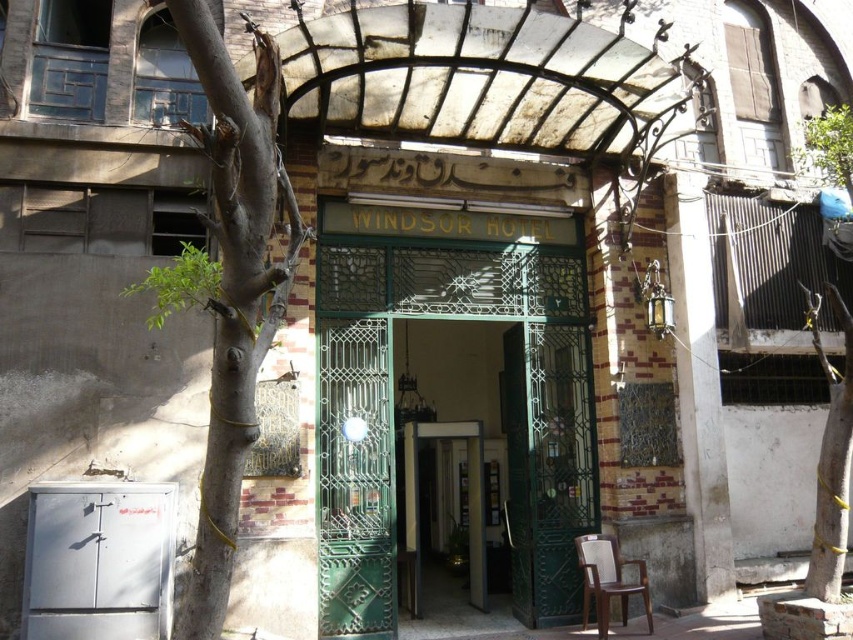
Who is shorter, gray bark tree at left or green textured bark at right?

Standing shorter between the two is green textured bark at right.

Where is `gray bark tree at left`? This screenshot has height=640, width=853. gray bark tree at left is located at coordinates (231, 288).

Identify the location of gray bark tree at left. Image resolution: width=853 pixels, height=640 pixels. (231, 288).

Consider the image. Does green metal gate at center have a lesser height compared to brown wooden chair at lower right?

No, green metal gate at center is not shorter than brown wooden chair at lower right.

Who is positioned more to the right, green metal gate at center or brown wooden chair at lower right?

Positioned to the right is brown wooden chair at lower right.

The image size is (853, 640). In order to click on green metal gate at center in this screenshot , I will do `click(492, 342)`.

In order to click on green metal gate at center in this screenshot , I will do `click(492, 342)`.

How far apart are gray bark tree at left and brown wooden chair at lower right?

The distance of gray bark tree at left from brown wooden chair at lower right is 4.51 meters.

Can you confirm if gray bark tree at left is thinner than brown wooden chair at lower right?

No.

In order to click on gray bark tree at left in this screenshot , I will do `click(231, 288)`.

Where is `gray bark tree at left`? This screenshot has width=853, height=640. gray bark tree at left is located at coordinates (231, 288).